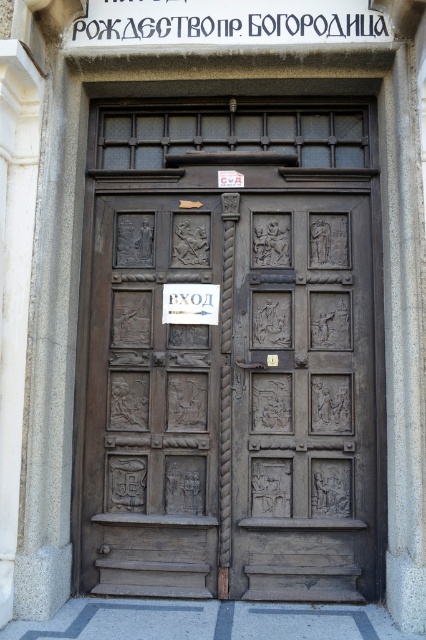
In the scene shown: Who is higher up, dark wood door at center or dark brown wood door at center?

dark wood door at center

Can you confirm if dark wood door at center is positioned below dark brown wood door at center?

Incorrect, dark wood door at center is not positioned below dark brown wood door at center.

The height and width of the screenshot is (640, 426). Find the location of `dark wood door at center`. dark wood door at center is located at coordinates click(230, 353).

You are a GUI agent. You are given a task and a screenshot of the screen. Output one action in this format:
    pyautogui.click(x=<x>, y=<y>)
    Task: Click on the dark wood door at center
    The height and width of the screenshot is (640, 426).
    Given the screenshot: What is the action you would take?
    pyautogui.click(x=230, y=353)

Who is higher up, brown carved wood door at center or dark brown wood door at center?

dark brown wood door at center

Who is more forward, [305,216] or [141,472]?

Point [141,472] is in front.

Identify the location of brown carved wood door at center. (302, 397).

Does dark wood door at center have a larger size compared to brown carved wood door at center?

Correct, dark wood door at center is larger in size than brown carved wood door at center.

Is point (322, 516) closer to camera compared to point (271, 541)?

No, (322, 516) is behind (271, 541).

Is point (144, 205) more distant than point (305, 316)?

Yes, it is behind point (305, 316).

At what (x,y) coordinates should I click in order to perform the action: click on dark wood door at center. Please return your answer as a coordinate pair (x, y). Looking at the image, I should click on (230, 353).